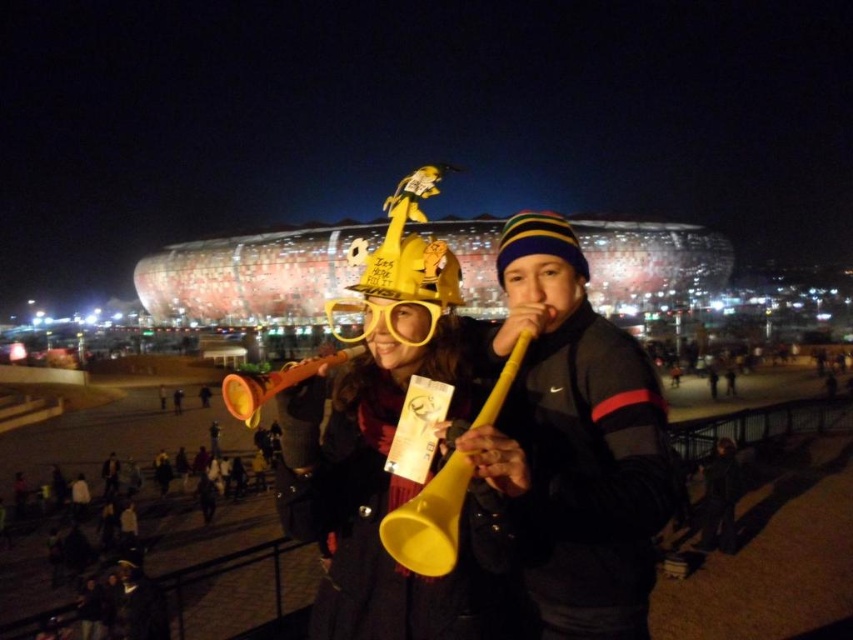
You are standing at the entrance of the stadium and see the yellow matte horn at center. You want to throw a small paper airplane to reach the person holding it. Considering the distance, can the paper airplane travel that far?

The yellow matte horn at center is 61.08 meters away from the viewer. A typical paper airplane can only fly about 10 to 30 meters, so it is unlikely to reach the person holding the yellow matte horn at center.

You are at a stadium during a game and want to locate the yellow matte horn at center and the matte orange trumpet at center. Based on their positions, which one is closer to the ground?

The yellow matte horn at center is located below the matte orange trumpet at center, so it is closer to the ground.